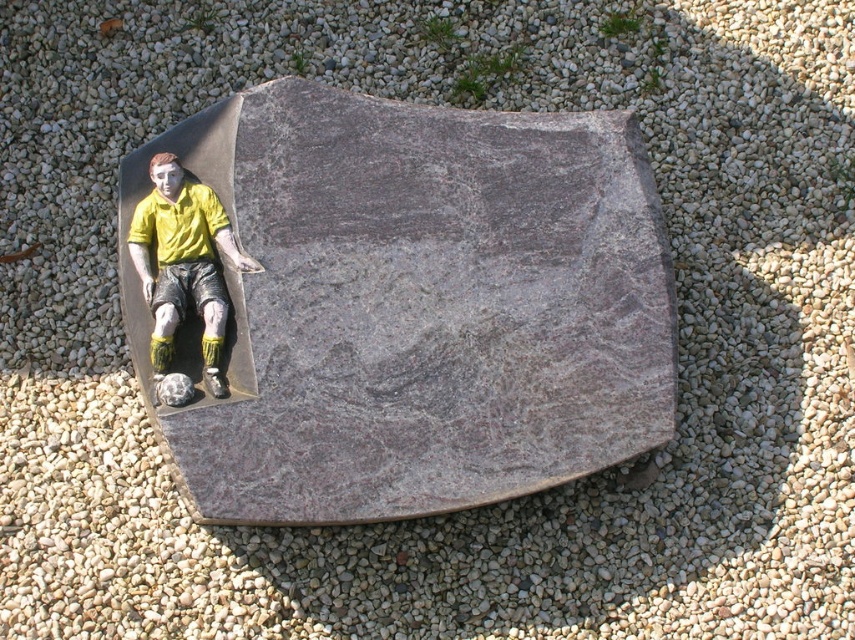
Can you confirm if granite stone at upper left is thinner than matte yellow shirt at center?

Incorrect, granite stone at upper left's width is not less than matte yellow shirt at center's.

Between granite stone at upper left and matte yellow shirt at center, which one appears on the right side from the viewer's perspective?

Positioned to the right is granite stone at upper left.

Does point (273, 413) come behind point (196, 236)?

No, (273, 413) is closer to viewer.

This screenshot has height=640, width=855. Find the location of `granite stone at upper left`. granite stone at upper left is located at coordinates (416, 305).